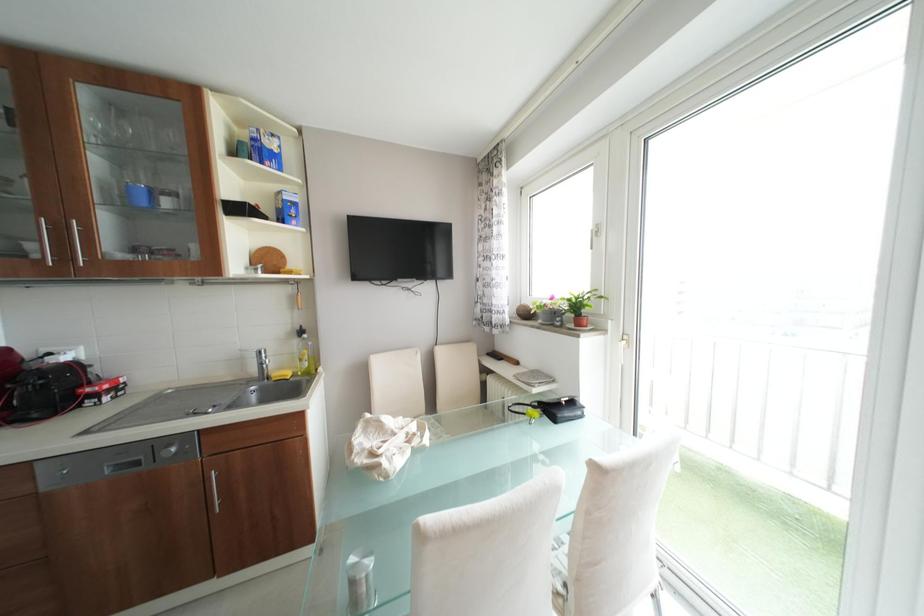
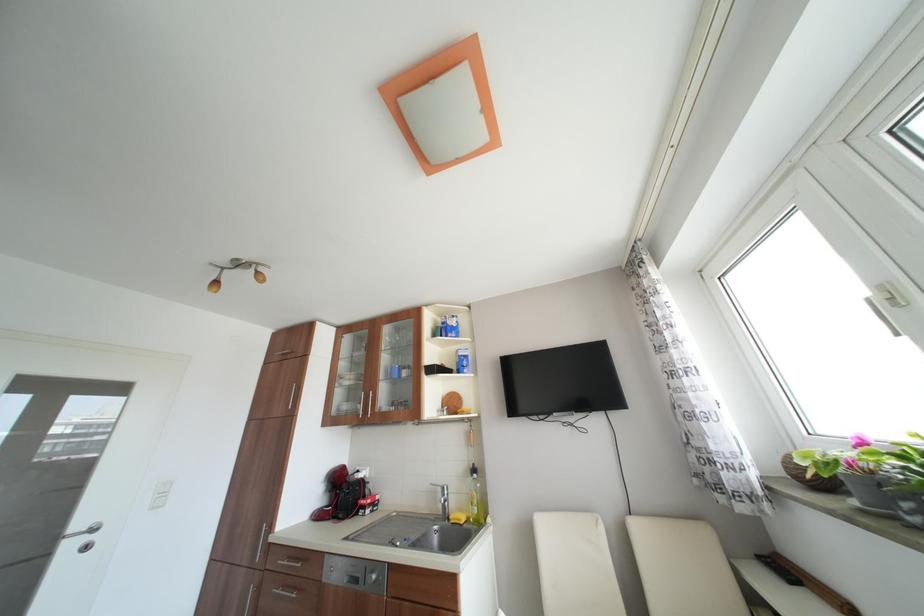
The first image is from the beginning of the video and the second image is from the end. How did the camera likely rotate when shooting the video?

The rotation direction of the camera is left-up.